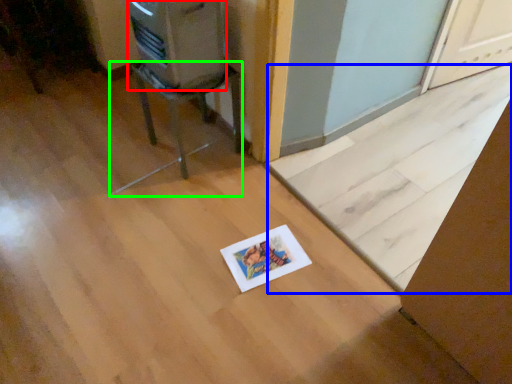
Question: Which is nearer to the appliance (highlighted by a red box)? doormat (highlighted by a blue box) or furniture (highlighted by a green box).

Choices:
 (A) doormat
 (B) furniture

Answer: (B)